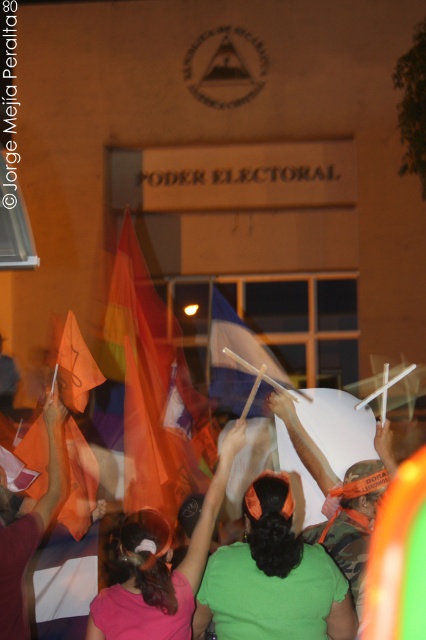
Looking at this image, you are a photographer standing at the camera position. You want to capture a closeup shot of the translucent fabric flag at center. Given that your camera can focus on subjects within 100 feet, will you be able to take the photo without moving closer?

The distance between the translucent fabric flag at center and the camera is 104.22 feet, which is beyond the camera focus range of 100 feet. Therefore, you cannot take the closeup shot without moving closer.

You are observing the nighttime protest scene outside the POder Electoral building. You notice two headbands among the protesters. The first is a green fabric headband at center and the second is a pink fabric headband at upper center. Which of these two headbands is lower in position?

The green fabric headband at center has a lesser height compared to the pink fabric headband at upper center, so the green fabric headband at center is lower in position.